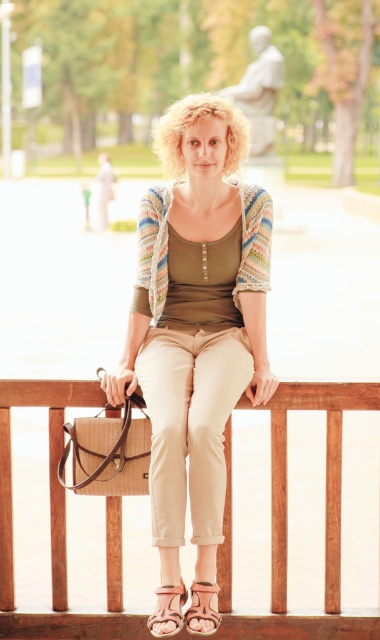
Based on the photo, who is positioned more to the right, matte beige pants at center or leather sandal at lower center?

From the viewer's perspective, leather sandal at lower center appears more on the right side.

Can you confirm if matte beige pants at center is thinner than leather sandal at lower center?

No.

What do you see at coordinates (196, 321) in the screenshot? The width and height of the screenshot is (380, 640). I see `matte beige pants at center` at bounding box center [196, 321].

Where is `matte beige pants at center`? The height and width of the screenshot is (640, 380). matte beige pants at center is located at coordinates (196, 321).

Does woven straw bag at lower left have a larger size compared to leather sandal at lower center?

Correct, woven straw bag at lower left is larger in size than leather sandal at lower center.

Which is below, woven straw bag at lower left or leather sandal at lower center?

leather sandal at lower center is lower down.

This screenshot has width=380, height=640. Describe the element at coordinates (107, 452) in the screenshot. I see `woven straw bag at lower left` at that location.

At what (x,y) coordinates should I click in order to perform the action: click on woven straw bag at lower left. Please return your answer as a coordinate pair (x, y). This screenshot has height=640, width=380. Looking at the image, I should click on (107, 452).

Which is behind, point (278, 604) or point (193, 632)?

The point (278, 604) is behind.

Does point (338, 486) come behind point (204, 609)?

Yes, point (338, 486) is behind point (204, 609).

The image size is (380, 640). I want to click on wooden fence at lower center, so click(286, 516).